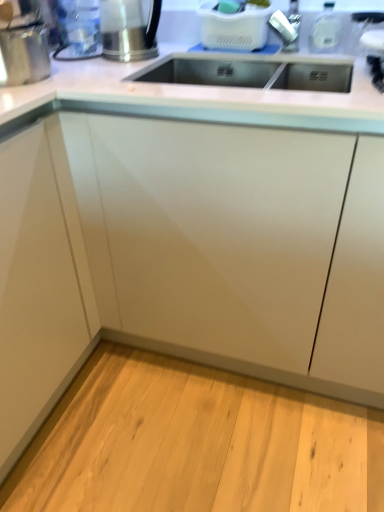
Question: Could you tell me if clear plastic water bottle at upper left, which ranks as the third appliance in right-to-left order, is turned towards brushed metal kettle at upper left, marked as the 3th appliance in a left-to-right arrangement?

Choices:
 (A) no
 (B) yes

Answer: (A)

Question: Considering the relative positions of clear plastic water bottle at upper left, which is the 2th appliance from left to right, and brushed metal kettle at upper left, which is counted as the second appliance, starting from the right, in the image provided, is clear plastic water bottle at upper left, which is the 2th appliance from left to right, to the left of brushed metal kettle at upper left, which is counted as the second appliance, starting from the right, from the viewer's perspective?

Choices:
 (A) no
 (B) yes

Answer: (B)

Question: Is clear plastic water bottle at upper left, which ranks as the third appliance in right-to-left order, directly adjacent to brushed metal kettle at upper left, marked as the 3th appliance in a left-to-right arrangement?

Choices:
 (A) yes
 (B) no

Answer: (A)

Question: From a real-world perspective, is clear plastic water bottle at upper left, which ranks as the third appliance in right-to-left order, located higher than brushed metal kettle at upper left, which is counted as the second appliance, starting from the right?

Choices:
 (A) no
 (B) yes

Answer: (B)

Question: Considering the relative positions of clear plastic water bottle at upper left, which is the 2th appliance from left to right, and brushed metal kettle at upper left, marked as the 3th appliance in a left-to-right arrangement, in the image provided, is clear plastic water bottle at upper left, which is the 2th appliance from left to right, to the right of brushed metal kettle at upper left, marked as the 3th appliance in a left-to-right arrangement, from the viewer's perspective?

Choices:
 (A) no
 (B) yes

Answer: (A)

Question: Considering their positions, is white plastic basket at upper center, the first appliance viewed from the right, located in front of or behind brushed metal kettle at upper left, which is counted as the second appliance, starting from the right?

Choices:
 (A) front
 (B) behind

Answer: (B)

Question: In the image, is white plastic basket at upper center, acting as the 4th appliance starting from the left, on the left side or the right side of brushed metal kettle at upper left, marked as the 3th appliance in a left-to-right arrangement?

Choices:
 (A) left
 (B) right

Answer: (B)

Question: From the image's perspective, is white plastic basket at upper center, acting as the 4th appliance starting from the left, above or below brushed metal kettle at upper left, which is counted as the second appliance, starting from the right?

Choices:
 (A) above
 (B) below

Answer: (A)

Question: From a real-world perspective, is white plastic basket at upper center, the first appliance viewed from the right, physically located above or below brushed metal kettle at upper left, marked as the 3th appliance in a left-to-right arrangement?

Choices:
 (A) below
 (B) above

Answer: (B)

Question: In terms of height, does clear plastic water bottle at upper left, which ranks as the third appliance in right-to-left order, look taller or shorter compared to white plastic basket at upper center, acting as the 4th appliance starting from the left?

Choices:
 (A) tall
 (B) short

Answer: (A)

Question: Which is correct: clear plastic water bottle at upper left, which ranks as the third appliance in right-to-left order, is inside white plastic basket at upper center, acting as the 4th appliance starting from the left, or outside of it?

Choices:
 (A) outside
 (B) inside

Answer: (A)

Question: Looking at the image, does clear plastic water bottle at upper left, which is the 2th appliance from left to right, seem bigger or smaller compared to white plastic basket at upper center, the first appliance viewed from the right?

Choices:
 (A) big
 (B) small

Answer: (B)

Question: From a real-world perspective, is clear plastic water bottle at upper left, which is the 2th appliance from left to right, above or below white plastic basket at upper center, the first appliance viewed from the right?

Choices:
 (A) below
 (B) above

Answer: (B)

Question: From a real-world perspective, is white glossy cabinet at center physically located above or below brushed metal kettle at upper left, which is counted as the second appliance, starting from the right?

Choices:
 (A) below
 (B) above

Answer: (A)

Question: Is point click(87, 170) closer or farther from the camera than point click(102, 54)?

Choices:
 (A) farther
 (B) closer

Answer: (B)